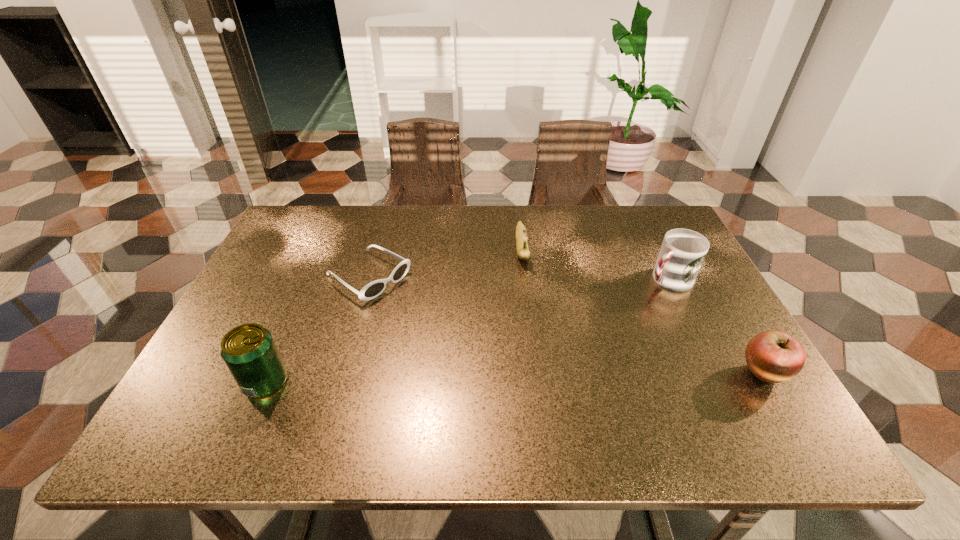
What are the coordinates of `vacant space positioned 0.060m with the lenses of the sunglasses facing outward` in the screenshot? It's located at (414, 305).

Image resolution: width=960 pixels, height=540 pixels. I want to click on vacant space located with the lenses of the sunglasses facing outward, so click(425, 312).

The height and width of the screenshot is (540, 960). Identify the location of vacant space located with the lenses of the sunglasses facing outward. [x=411, y=303].

I want to click on free location located 0.100m on the side of the cup where the handle is located, so click(x=627, y=304).

Identify the location of vacant space located 0.240m on the side of the cup where the handle is located. (588, 328).

This screenshot has height=540, width=960. What are the coordinates of `free space located on the side of the cup where the handle is located` in the screenshot? It's located at (539, 360).

Image resolution: width=960 pixels, height=540 pixels. In order to click on object that is at the far edge in this screenshot , I will do `click(523, 252)`.

The image size is (960, 540). I want to click on beer can that is at the near edge, so click(x=248, y=350).

I want to click on apple that is at the near edge, so click(x=773, y=356).

Where is `object that is at the left edge`? This screenshot has width=960, height=540. object that is at the left edge is located at coordinates (248, 350).